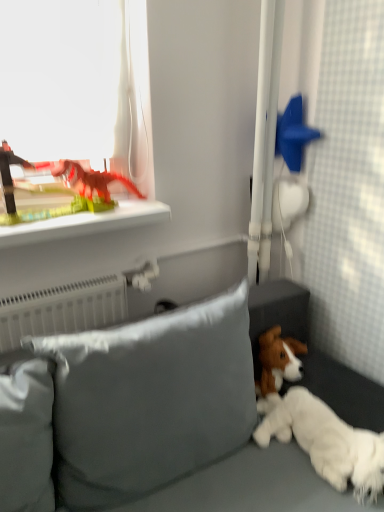
Question: Is matte plastic dinosaur at upper left, placed as the second toy when sorted from right to left, next to white fluffy dog at lower right?

Choices:
 (A) no
 (B) yes

Answer: (A)

Question: Considering the relative sizes of matte plastic dinosaur at upper left, which is counted as the first toy, starting from the left, and white fluffy dog at lower right in the image provided, is matte plastic dinosaur at upper left, which is counted as the first toy, starting from the left, shorter than white fluffy dog at lower right?

Choices:
 (A) no
 (B) yes

Answer: (A)

Question: Is matte plastic dinosaur at upper left, placed as the second toy when sorted from right to left, positioned before white fluffy dog at lower right?

Choices:
 (A) no
 (B) yes

Answer: (A)

Question: From a real-world perspective, is matte plastic dinosaur at upper left, which is counted as the first toy, starting from the left, under white fluffy dog at lower right?

Choices:
 (A) yes
 (B) no

Answer: (B)

Question: Is matte plastic dinosaur at upper left, placed as the second toy when sorted from right to left, outside white fluffy dog at lower right?

Choices:
 (A) yes
 (B) no

Answer: (A)

Question: Is point (294, 122) positioned closer to the camera than point (104, 228)?

Choices:
 (A) farther
 (B) closer

Answer: (A)

Question: Is blue matte star at upper right, acting as the 2th toy starting from the left, taller or shorter than green plastic dinosaur at upper left?

Choices:
 (A) short
 (B) tall

Answer: (B)

Question: Based on their sizes in the image, would you say blue matte star at upper right, which is the first toy from right to left, is bigger or smaller than green plastic dinosaur at upper left?

Choices:
 (A) small
 (B) big

Answer: (A)

Question: In terms of width, does blue matte star at upper right, acting as the 2th toy starting from the left, look wider or thinner when compared to green plastic dinosaur at upper left?

Choices:
 (A) wide
 (B) thin

Answer: (B)

Question: Is point (192, 308) positioned closer to the camera than point (302, 393)?

Choices:
 (A) closer
 (B) farther

Answer: (A)

Question: In terms of height, does satin gray pillow at lower center look taller or shorter compared to white fluffy dog at lower right?

Choices:
 (A) short
 (B) tall

Answer: (B)

Question: Is satin gray pillow at lower center to the left or to the right of white fluffy dog at lower right in the image?

Choices:
 (A) right
 (B) left

Answer: (B)

Question: In the image, is satin gray pillow at lower center positioned in front of or behind white fluffy dog at lower right?

Choices:
 (A) behind
 (B) front

Answer: (B)

Question: Is point (297, 96) positioned closer to the camera than point (296, 403)?

Choices:
 (A) farther
 (B) closer

Answer: (A)

Question: From a real-world perspective, is blue matte star at upper right, acting as the 2th toy starting from the left, above or below white fluffy dog at lower right?

Choices:
 (A) above
 (B) below

Answer: (A)